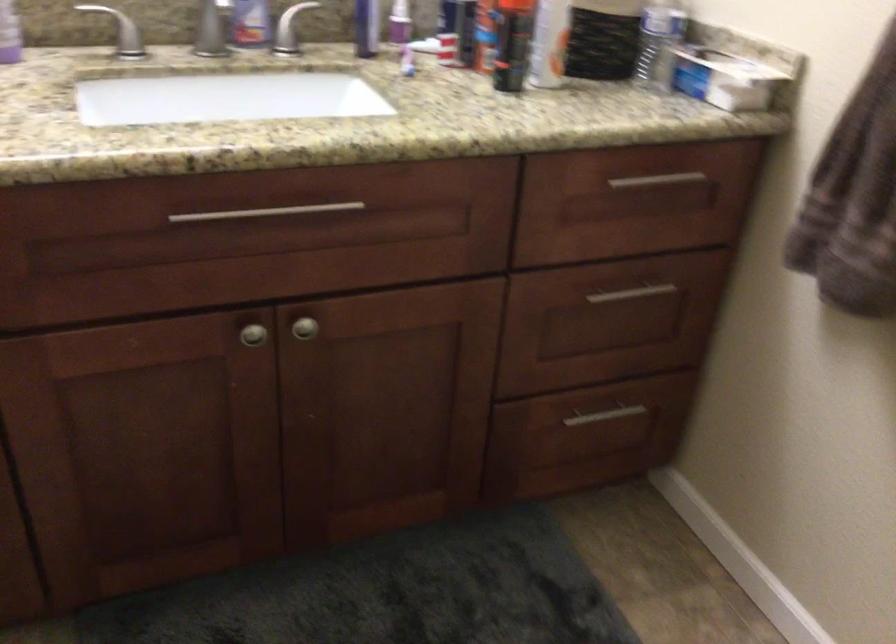
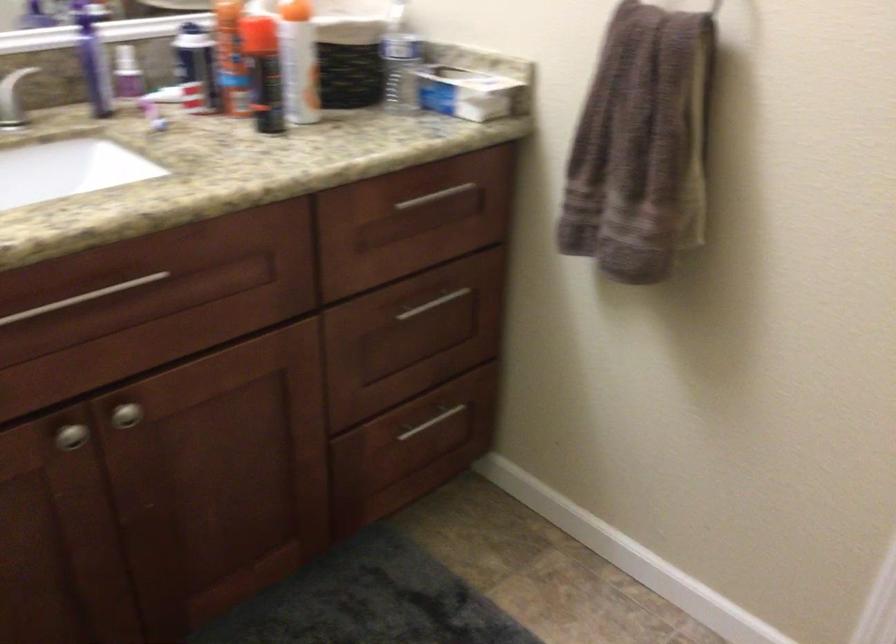
Find the pixel in the second image that matches the point at 720,79 in the first image.

(470, 91)